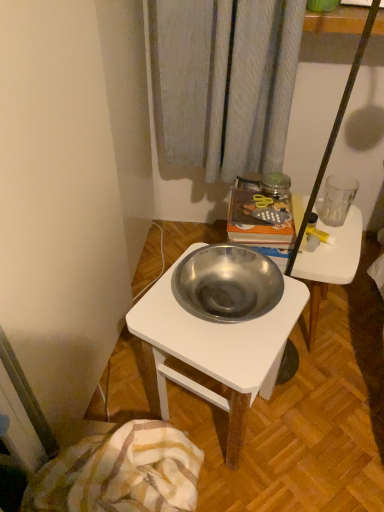
What are the coordinates of `spots to the right of metallic white desk at center` in the screenshot? It's located at point(322,425).